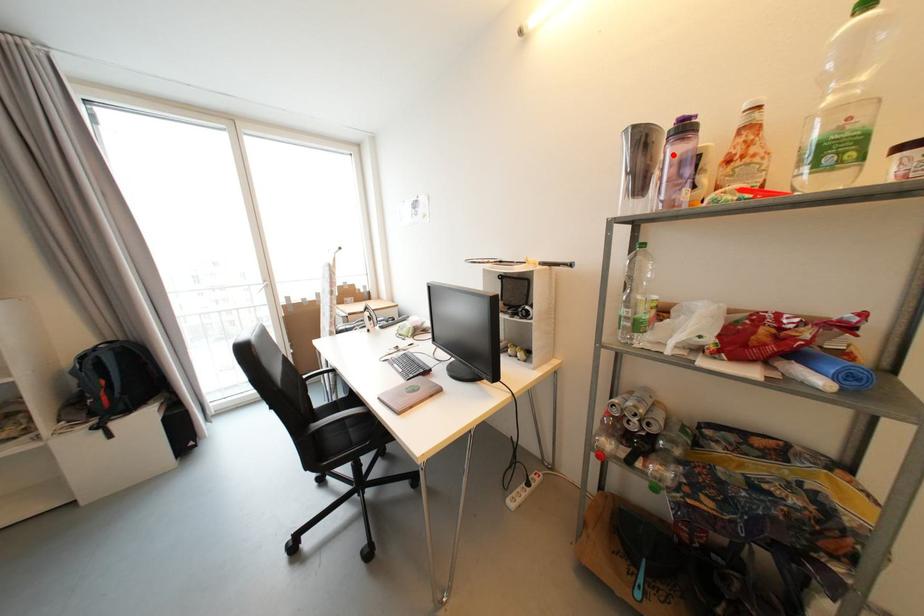
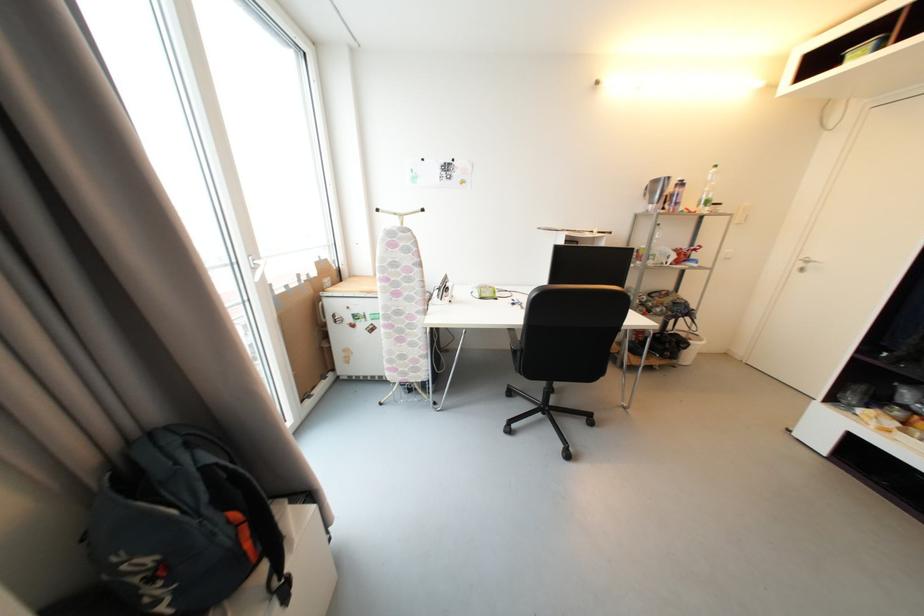
Locate, in the second image, the point that corresponds to the highlighted location in the first image.

(674, 192)